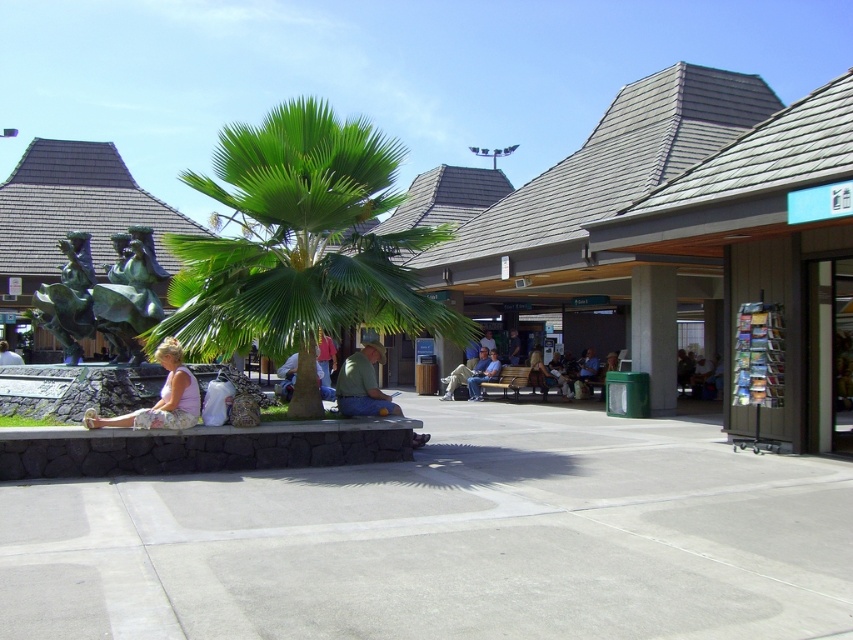
You are an artist trying to sketch the scene. You notice two clothing items in the image. The light pink fabric skirt at lower left and the green matte shirt at center. Which clothing item has a wider width in the image?

The light pink fabric skirt at lower left has a larger width than the green matte shirt at center according to the description.

You are standing at the entrance of the transportation hub and want to take a photo of the bronze statue at left and the light blue jeans at center. Which object should you focus on first to ensure both are in the frame?

You should focus on the bronze statue at left first because it is closer to the viewer than the light blue jeans at center, so adjusting the camera to capture it will help include the light blue jeans at center in the frame as well.

You are standing at the center of the outdoor scene. There is a light pink fabric skirt at lower left represented by point [161,397]. Where is the light pink fabric skirt located relative to the statue of a person riding a horse?

The light pink fabric skirt at lower left is located to the right of the statue of a person riding a horse because the point [161,397] is to the right of the statue.